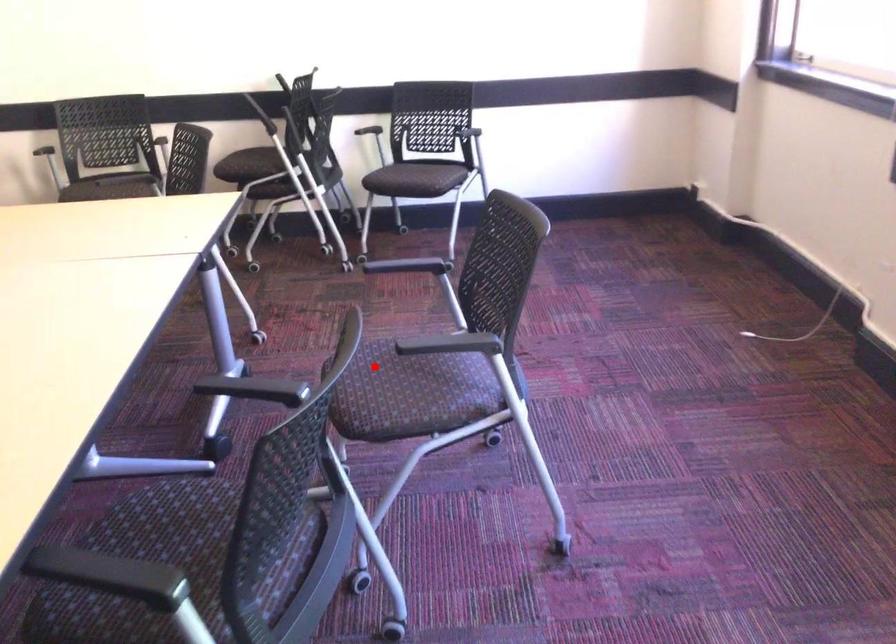
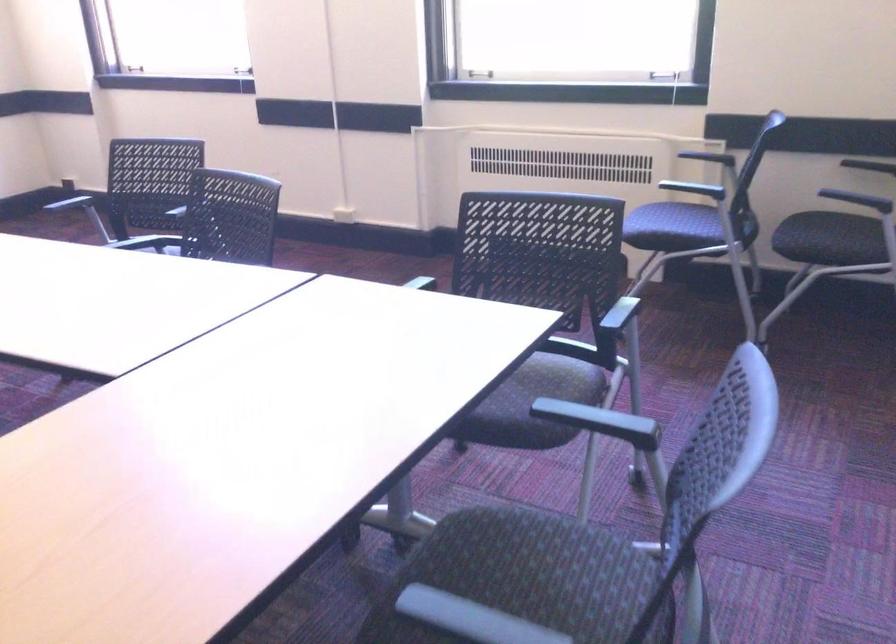
Question: I am providing you with two images of the same scene from different viewpoints. A red point is marked on the first image. Can you still see the location of the red point in image 2?

Choices:
 (A) Yes
 (B) No

Answer: (B)